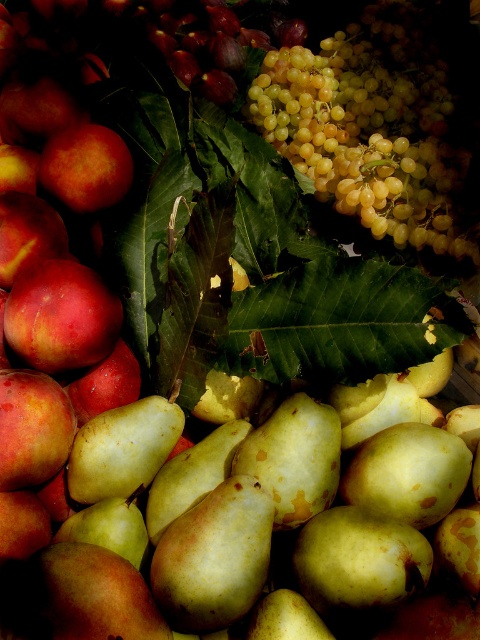
Question: Among these points, which one is nearest to the camera?

Choices:
 (A) (436, 252)
 (B) (74, 278)
 (C) (111, 196)

Answer: (B)

Question: Is the position of ripe red apple at center more distant than that of matte red apple at center?

Choices:
 (A) no
 (B) yes

Answer: (A)

Question: Estimate the real-world distances between objects in this image. Which object is farther from the ripe red apple at center?

Choices:
 (A) shiny red apple at upper left
 (B) yellow matte grapes at upper right
 (C) matte red apple at lower left
 (D) matte red apple at center

Answer: (B)

Question: Is ripe red apple at center smaller than shiny red apple at upper left?

Choices:
 (A) yes
 (B) no

Answer: (B)

Question: Which point is closer to the camera?

Choices:
 (A) matte red apple at center
 (B) matte peach at left
 (C) matte red apple at lower left

Answer: (C)

Question: Does ripe red apple at center appear under matte red apple at center?

Choices:
 (A) no
 (B) yes

Answer: (A)